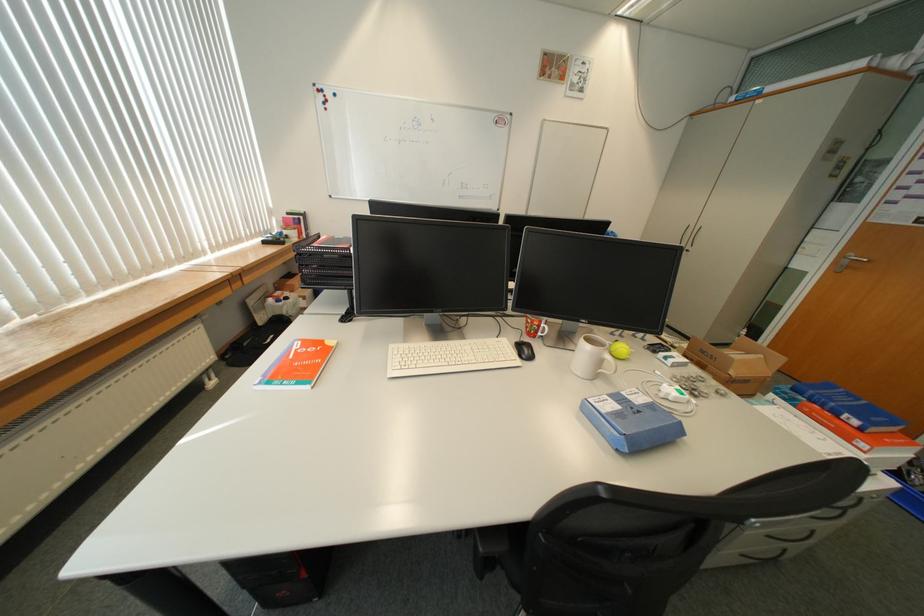
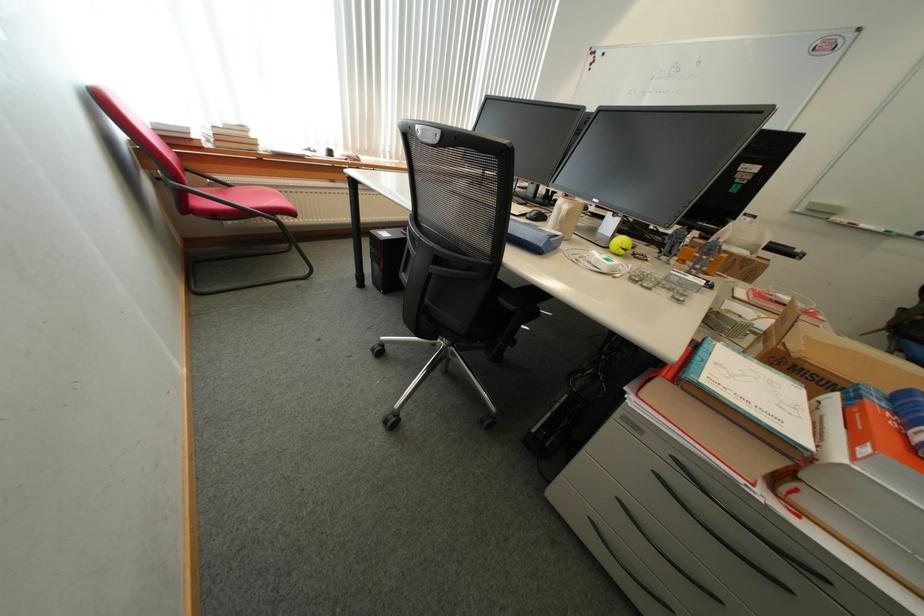
Where in the second image is the point corresponding to (x=857, y=440) from the first image?

(864, 446)